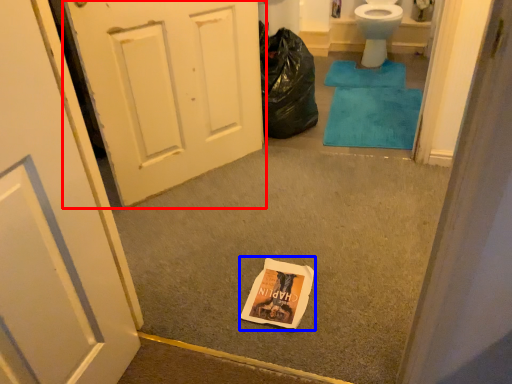
Question: Which object appears farthest to the camera in this image, door (highlighted by a red box) or paperback book (highlighted by a blue box)?

Choices:
 (A) door
 (B) paperback book

Answer: (A)